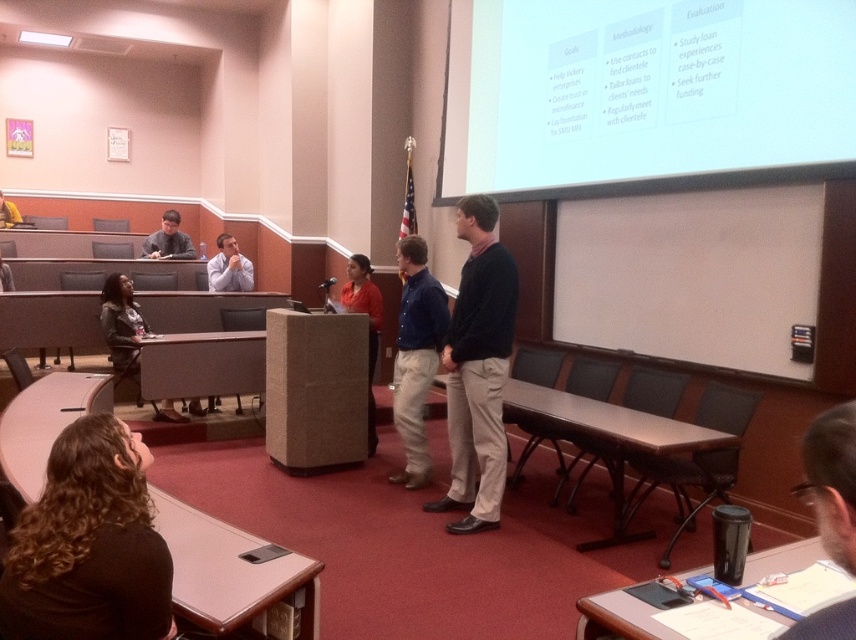
In the classroom scene, there is a podium with a microphone and two people near it. You are standing at the point marked as point (88, 545). Can you see the dark brown curly hair at lower left from your current position?

Yes, since the dark brown curly hair at lower left is located at point (88, 545), you are standing right at that location and can see it directly.

You are sitting at the back of the classroom and want to see the dark brown hair at lower right. Based on its position, can you estimate whether it is closer to the front or the back of the room?

The dark brown hair at lower right is located at point [831,481], which places it closer to the back of the room since the coordinates are near the edge.